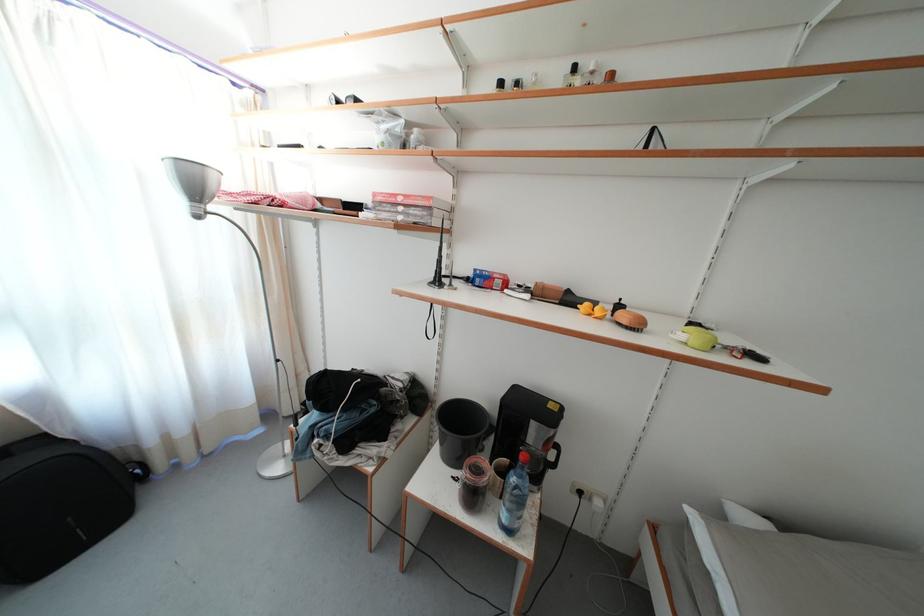
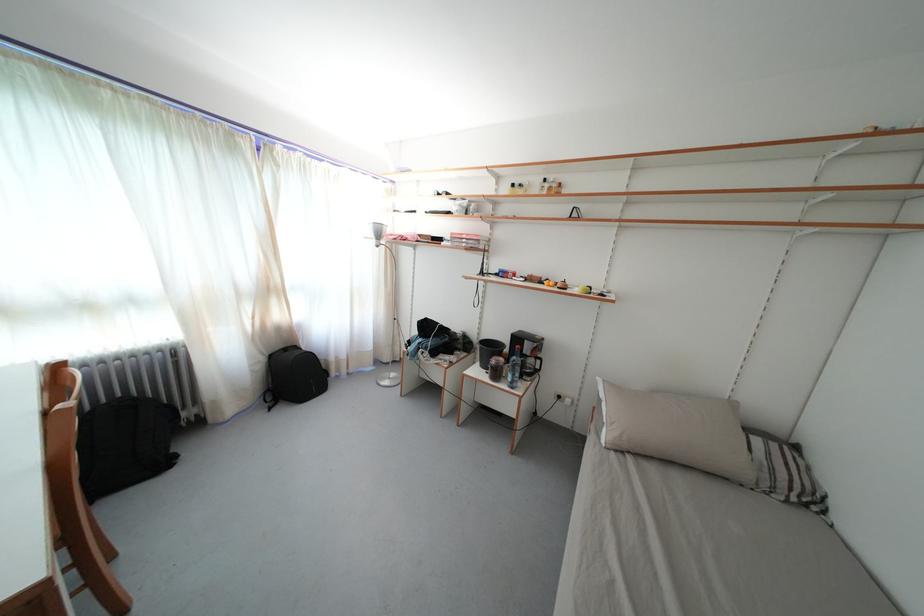
Locate, in the second image, the point that corresponds to pixel 521 493 in the first image.

(520, 367)